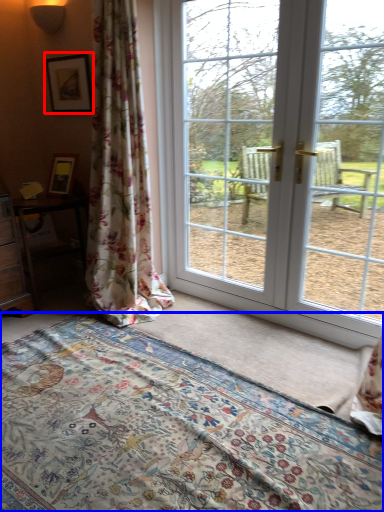
Question: Which object is closer to the camera taking this photo, picture frame (highlighted by a red box) or bed (highlighted by a blue box)?

Choices:
 (A) picture frame
 (B) bed

Answer: (B)